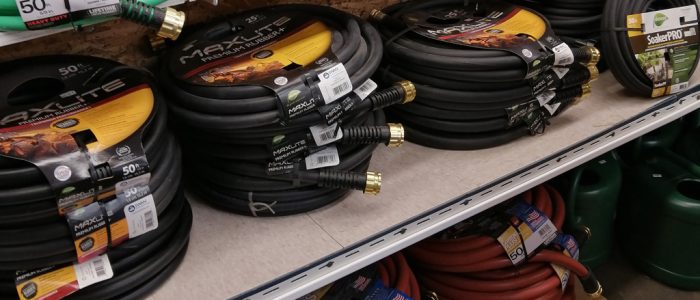
The image size is (700, 300). What are the coordinates of `jar` in the screenshot? It's located at (600, 216).